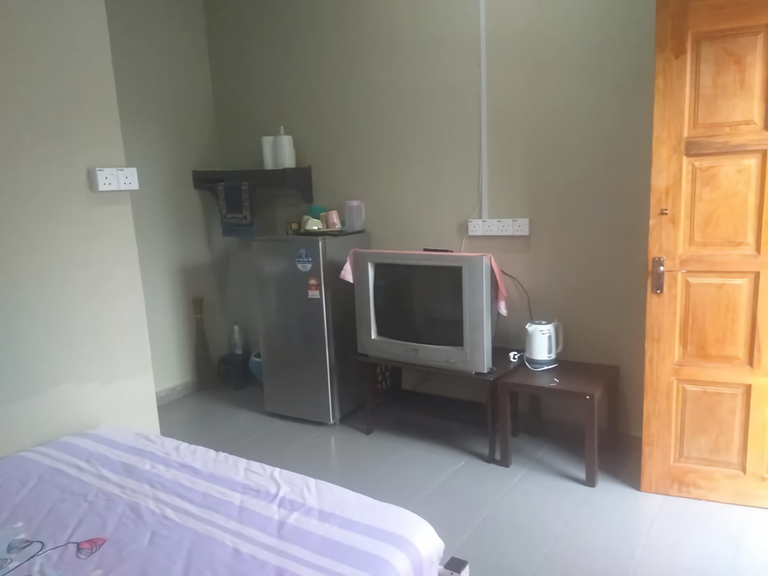
This screenshot has height=576, width=768. In order to click on refrigerator in this screenshot , I will do `click(296, 367)`.